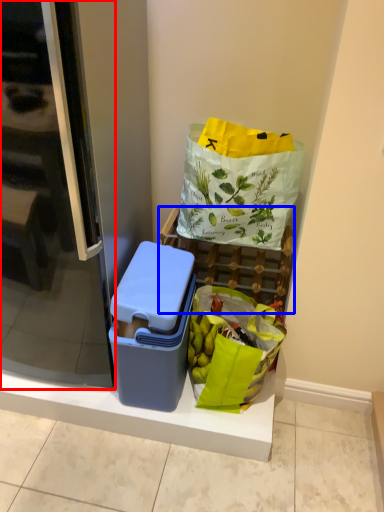
Question: Which of the following is the closest to the observer, screen door (highlighted by a red box) or shelf (highlighted by a blue box)?

Choices:
 (A) screen door
 (B) shelf

Answer: (A)